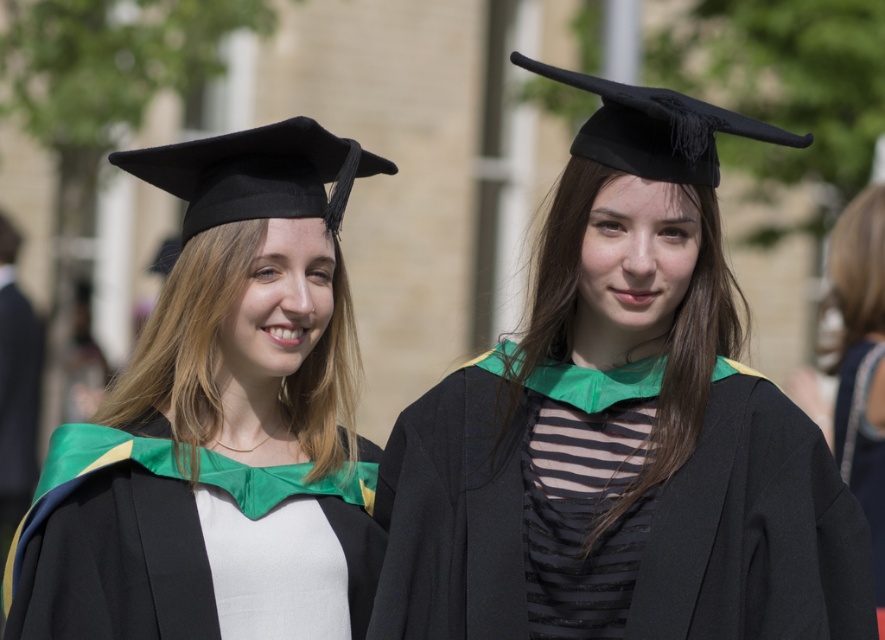
You are a photographer at a graduation ceremony. You need to adjust the camera focus so that both the satin green graduation gown at center and the black satin graduation gown at right are in focus. Which gown should you focus on first to ensure both are sharp?

The satin green graduation gown at center is not as tall as the black satin graduation gown at right. To ensure both are in focus, you should focus on the taller black satin graduation gown at right first, as focusing on the farther object first allows for better depth of field coverage.

You are a photographer at a graduation ceremony. You need to capture a closeup shot of both the matte black graduation cap at center and the satin black graduation cap at left. The camera can only focus on objects within a 20 inch range. Can you capture both caps in one shot?

The matte black graduation cap at center is 19.82 inches from the satin black graduation cap at left, which is within the 20 inch range. Therefore, both caps can be captured in one shot.

You are a photographer at a graduation ceremony. You need to position a camera to capture both the satin black graduation cap at left and the black satin graduation gown at right in the same frame. Based on their positions, which object is located to the left of the other?

The satin black graduation cap at left is located to the left of the black satin graduation gown at right.